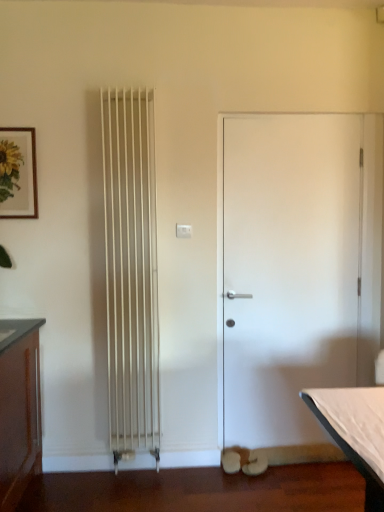
Question: From the image's perspective, is wooden framed sunflower print at upper left positioned above or below white matte door at center?

Choices:
 (A) above
 (B) below

Answer: (A)

Question: Looking at the image, does wooden framed sunflower print at upper left seem bigger or smaller compared to white matte door at center?

Choices:
 (A) big
 (B) small

Answer: (B)

Question: Is wooden framed sunflower print at upper left in front of or behind white matte door at center in the image?

Choices:
 (A) behind
 (B) front

Answer: (B)

Question: In the image, is white matte door at center positioned in front of or behind wooden framed sunflower print at upper left?

Choices:
 (A) front
 (B) behind

Answer: (B)

Question: Based on their sizes in the image, would you say white matte door at center is bigger or smaller than wooden framed sunflower print at upper left?

Choices:
 (A) small
 (B) big

Answer: (B)

Question: From a real-world perspective, is white matte door at center above or below wooden framed sunflower print at upper left?

Choices:
 (A) above
 (B) below

Answer: (B)

Question: Is white matte door at center wider or thinner than wooden framed sunflower print at upper left?

Choices:
 (A) wide
 (B) thin

Answer: (A)